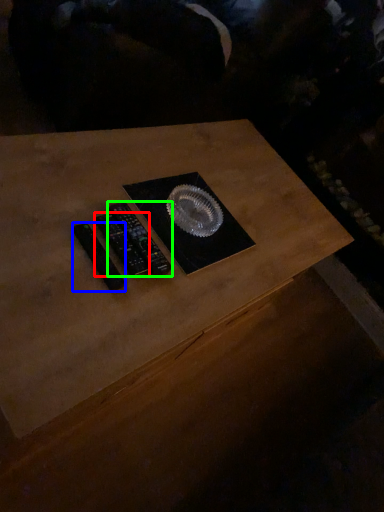
Question: Considering the real-world distances, which object is farthest from control (highlighted by a red box)? control (highlighted by a blue box) or control (highlighted by a green box)?

Choices:
 (A) control
 (B) control

Answer: (A)